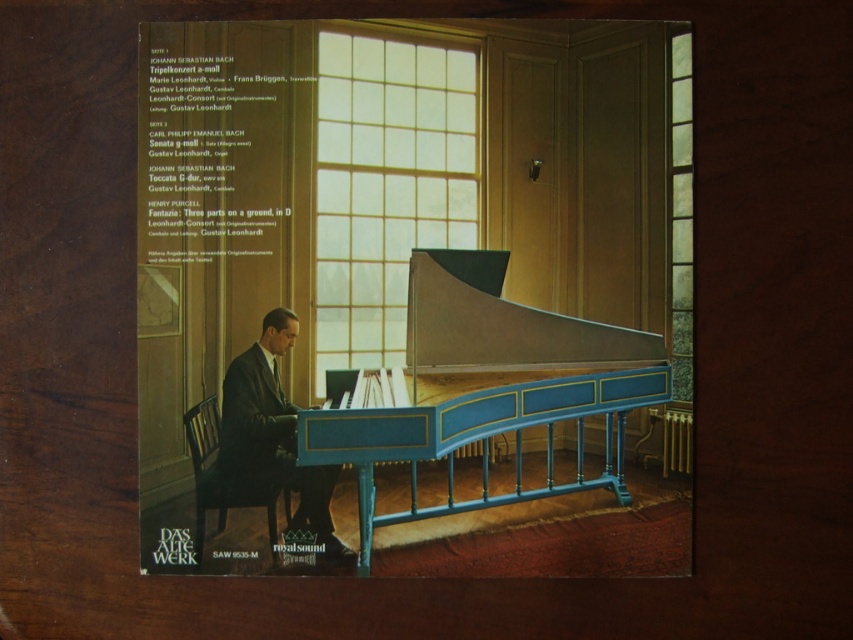
Question: Among these points, which one is nearest to the camera?

Choices:
 (A) (242, 474)
 (B) (526, 326)

Answer: (A)

Question: Is blue polished wood harpsichord at center to the left of dark suit at center from the viewer's perspective?

Choices:
 (A) no
 (B) yes

Answer: (A)

Question: Where is blue polished wood harpsichord at center located in relation to dark suit at center in the image?

Choices:
 (A) right
 (B) left

Answer: (A)

Question: Is blue polished wood harpsichord at center positioned at the back of dark suit at center?

Choices:
 (A) yes
 (B) no

Answer: (A)

Question: Among these objects, which one is farthest from the camera?

Choices:
 (A) blue polished wood harpsichord at center
 (B) dark suit at center

Answer: (A)